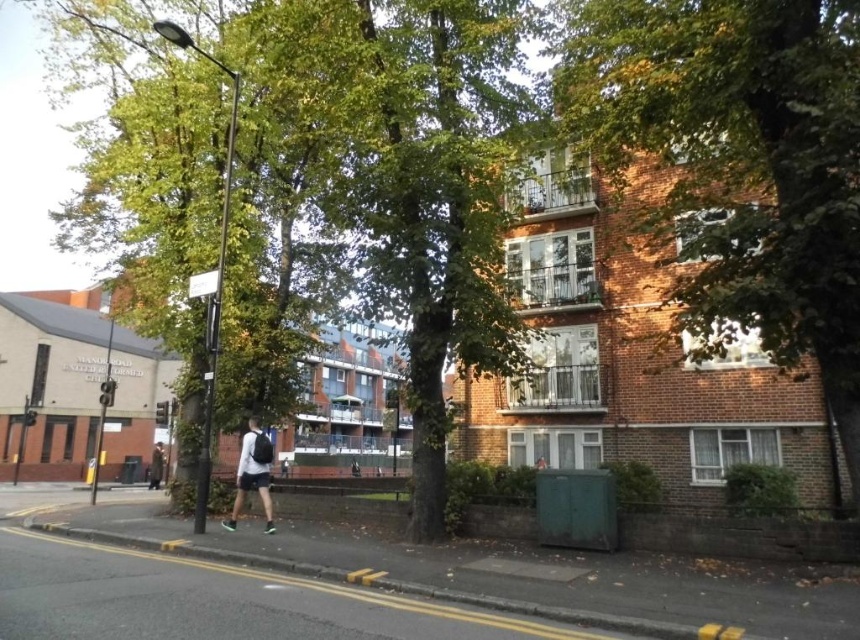
You are a delivery person who needs to deliver a package to the brick building on the right. You see the green leafy tree at upper center and the dark gray backpack at lower left. Which object is taller?

The green leafy tree at upper center is much taller than the dark gray backpack at lower left.

In the scene shown: You are standing at the pedestrian on the sidewalk in the urban street scene. You notice two points marked in the image. Which point, point (827,385) or point (161,456), is closer to you?

Point (827,385) is closer to the camera than point (161,456), so the point closer to you is point (827,385).

You are a delivery person trying to navigate through the urban street scene. You see a green leafy tree at upper center and a white matte shirt at center. Which object is higher in the image?

The green leafy tree at upper center is located above the white matte shirt at center, so the green leafy tree at upper center is higher in the image.